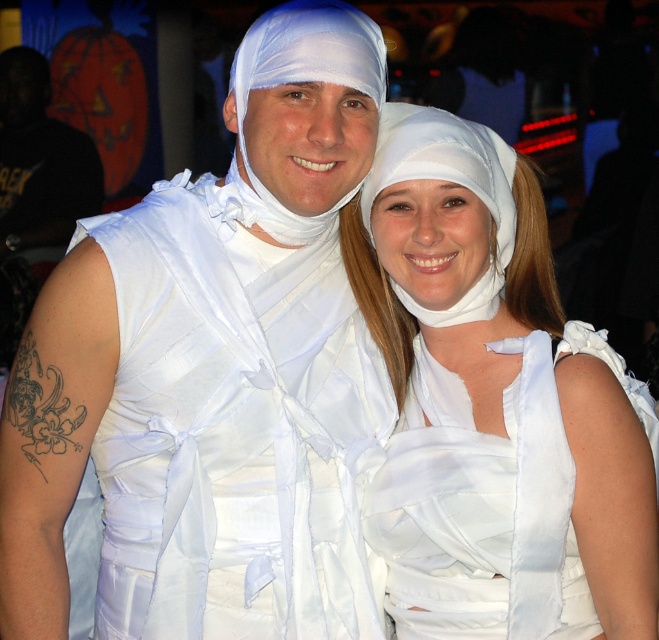
You are attending a Halloween party and want to take a photo with the white satin dress at center. Where should you position yourself relative to the dress to ensure it is centered in your camera frame?

To center the white satin dress at center in your camera frame, position yourself directly in front of it at the coordinates specified by the 2D location point at (500, 410).